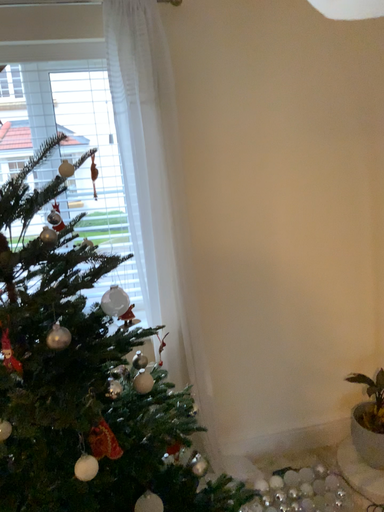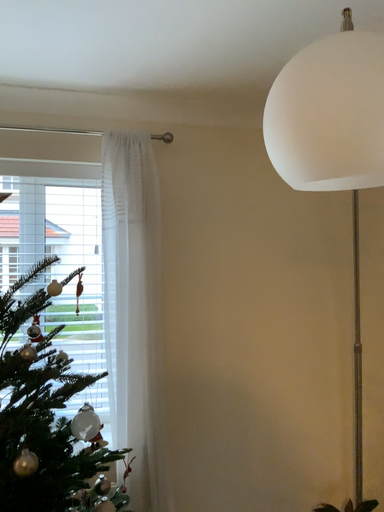
Question: Which way did the camera rotate in the video?

Choices:
 (A) rotated upward
 (B) rotated downward

Answer: (A)